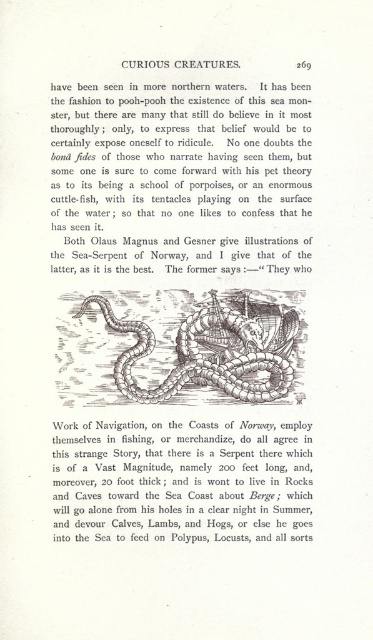
Who is positioned more to the left, matte paper text at upper center or black paper text at center?

matte paper text at upper center is more to the left.

Is matte paper text at upper center behind black paper text at center?

No.

Who is more forward, (55, 241) or (133, 509)?

Point (133, 509)

Image resolution: width=373 pixels, height=640 pixels. In order to click on matte paper text at upper center in this screenshot , I will do `click(177, 173)`.

Which of these two, matte paper text at upper center or grayish-brown scaly snake at center, stands shorter?

Standing shorter between the two is grayish-brown scaly snake at center.

Who is positioned more to the right, matte paper text at upper center or grayish-brown scaly snake at center?

Positioned to the right is grayish-brown scaly snake at center.

Who is more forward, [186,196] or [136,353]?

Point [186,196] is in front.

The image size is (373, 640). What are the coordinates of `matte paper text at upper center` in the screenshot? It's located at (177, 173).

Measure the distance from black paper text at center to grayish-brown scaly snake at center.

black paper text at center and grayish-brown scaly snake at center are 16.22 centimeters apart.

You are a GUI agent. You are given a task and a screenshot of the screen. Output one action in this format:
    pyautogui.click(x=<x>, y=<y>)
    Task: Click on the black paper text at center
    
    Given the screenshot: What is the action you would take?
    pyautogui.click(x=183, y=481)

Find the location of a particular element. This screenshot has width=373, height=640. black paper text at center is located at coordinates (183, 481).

Identify the location of black paper text at center. (183, 481).